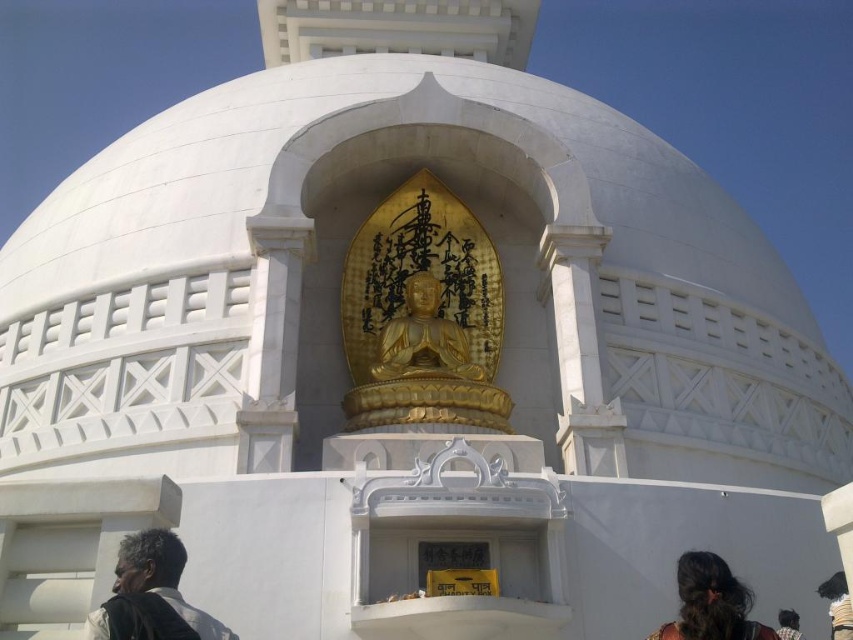
Can you confirm if goldmaterial/texturebuddha at center is smaller than dark brown hair at lower center?

No.

Between goldmaterial/texturebuddha at center and dark brown hair at lower center, which one is positioned higher?

goldmaterial/texturebuddha at center is above.

Where is `goldmaterial/texturebuddha at center`? goldmaterial/texturebuddha at center is located at coordinates (422, 314).

In the scene shown: Who is shorter, gold polished statue at center or black fabric at lower right?

Standing shorter between the two is black fabric at lower right.

Does gold polished statue at center appear on the right side of black fabric at lower right?

In fact, gold polished statue at center is to the left of black fabric at lower right.

Which is in front, point (426, 316) or point (820, 593)?

Positioned in front is point (820, 593).

You are a GUI agent. You are given a task and a screenshot of the screen. Output one action in this format:
    pyautogui.click(x=<x>, y=<y>)
    Task: Click on the gold polished statue at center
    This screenshot has height=640, width=853.
    Given the screenshot: What is the action you would take?
    pyautogui.click(x=422, y=339)

Which of these two, goldmaterial/texturebuddha at center or gold polished statue at center, stands taller?

Standing taller between the two is goldmaterial/texturebuddha at center.

Which is behind, point (451, 323) or point (427, 307)?

The point (427, 307) is more distant.

From the picture: Who is more distant from viewer, [380,257] or [405,317]?

Point [380,257]

At what (x,y) coordinates should I click in order to perform the action: click on goldmaterial/texturebuddha at center. Please return your answer as a coordinate pair (x, y). Looking at the image, I should click on (422, 314).